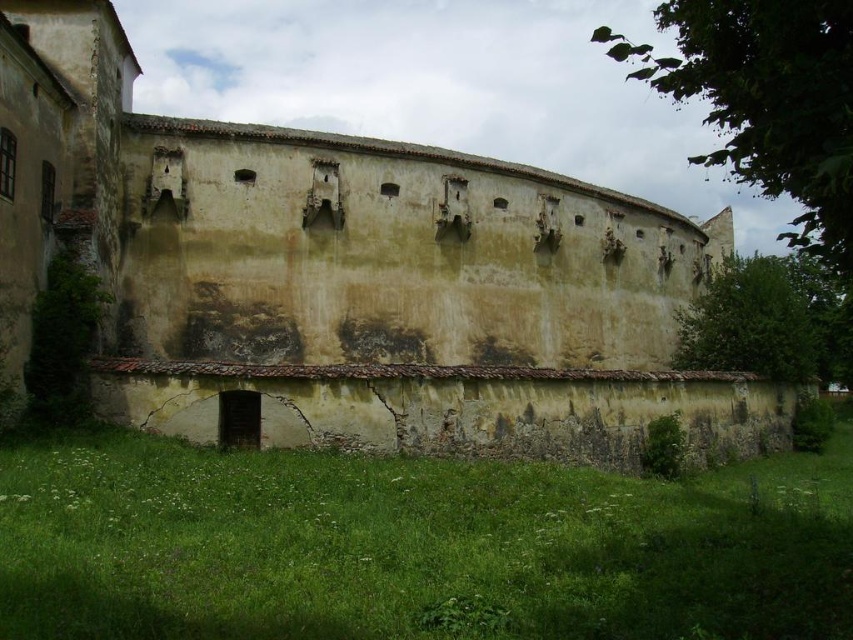
Question: Which point is closer to the camera?

Choices:
 (A) (386, 588)
 (B) (165, 262)

Answer: (A)

Question: Can you confirm if weathered stone wall at center is positioned below green grass at lower center?

Choices:
 (A) yes
 (B) no

Answer: (B)

Question: Which point is farther to the camera?

Choices:
 (A) green grass at lower center
 (B) weathered stone wall at center

Answer: (B)

Question: Is weathered stone wall at center positioned before green grass at lower center?

Choices:
 (A) yes
 (B) no

Answer: (B)

Question: Is weathered stone wall at center to the left of green grass at lower center from the viewer's perspective?

Choices:
 (A) yes
 (B) no

Answer: (B)

Question: Which of the following is the closest to the observer?

Choices:
 (A) green grass at lower center
 (B) weathered stone wall at center

Answer: (A)